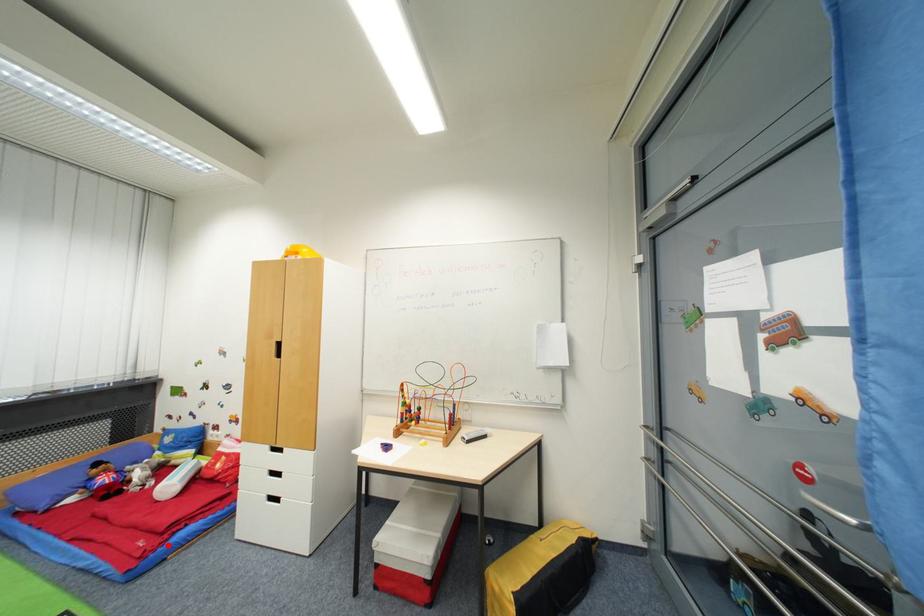
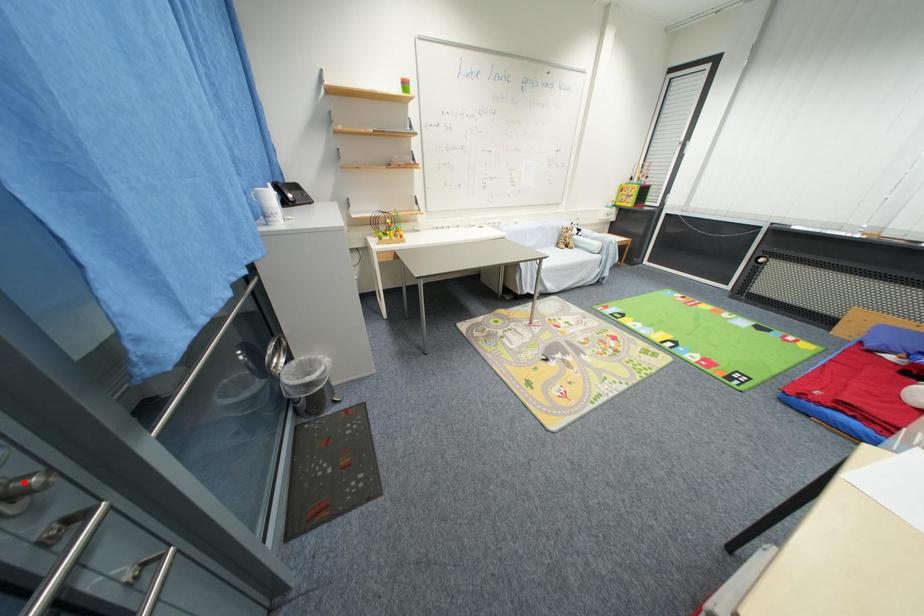
I am providing you with two images of the same scene from different viewpoints. A red point is marked on the first image and another point is marked on the second image. Do the highlighted points in image1 and image2 indicate the same real-world spot?

No